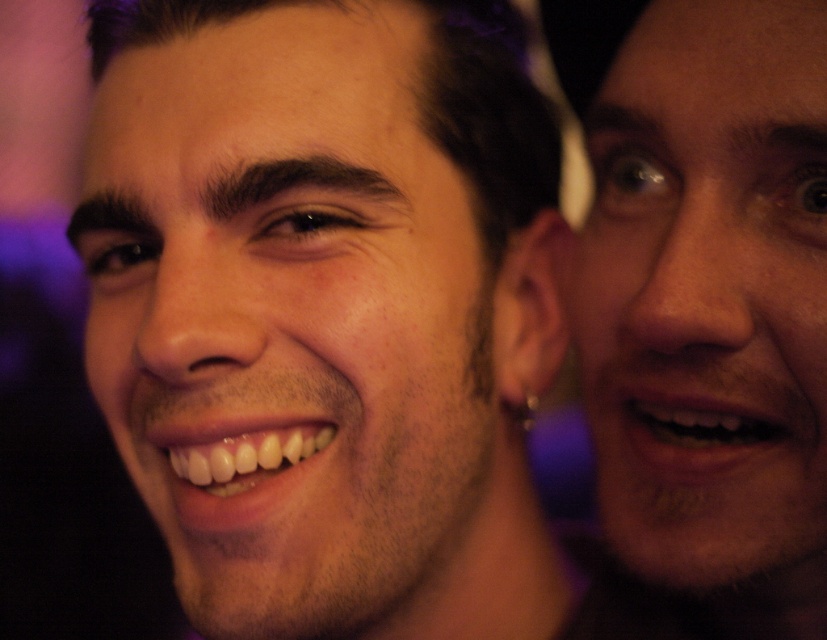
Based on the scene description, which face, the smooth skin face at center or the smooth skin face at right, appears taller in the image?

The smooth skin face at center appears taller than the smooth skin face at right in the image.